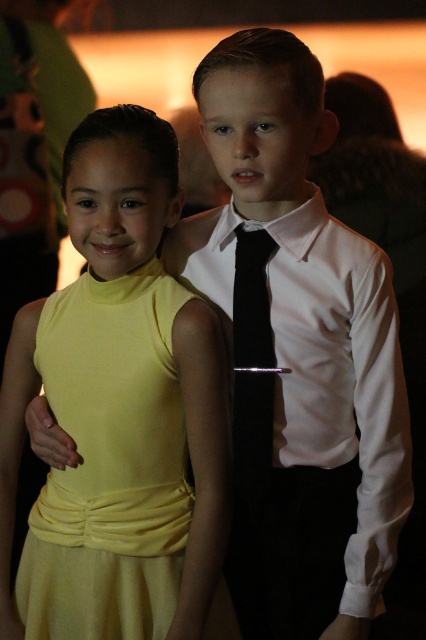
Question: Does matte yellow dress at center lie in front of white smooth dress shirt at center?

Choices:
 (A) yes
 (B) no

Answer: (A)

Question: Observing the image, what is the correct spatial positioning of matte yellow dress at center in reference to black silk tie at center?

Choices:
 (A) below
 (B) above

Answer: (A)

Question: Which point is closer to the camera?

Choices:
 (A) white smooth dress shirt at center
 (B) matte yellow dress at center
 (C) black silk tie at center

Answer: (B)

Question: Based on their relative distances, which object is nearer to the black silk tie at center?

Choices:
 (A) matte yellow dress at center
 (B) white smooth dress shirt at center

Answer: (B)

Question: Is white smooth dress shirt at center closer to camera compared to black silk tie at center?

Choices:
 (A) no
 (B) yes

Answer: (B)

Question: Which object is positioned farthest from the white smooth dress shirt at center?

Choices:
 (A) matte yellow dress at center
 (B) black silk tie at center

Answer: (A)